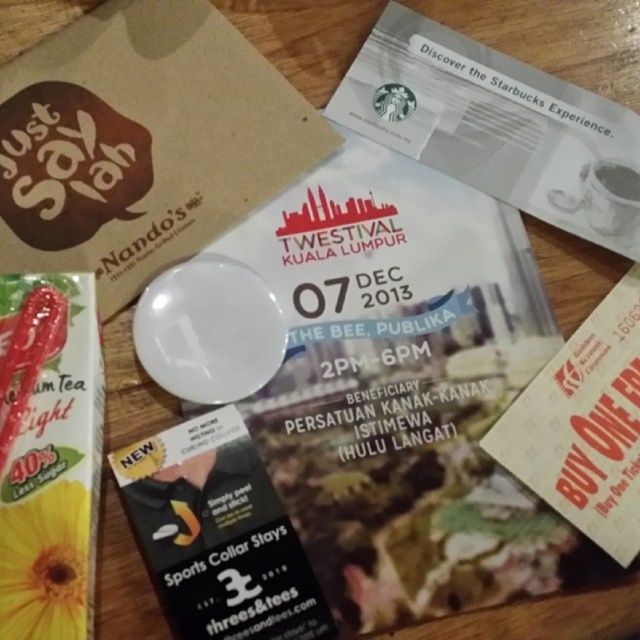
Question: Which point appears farthest from the camera in this image?

Choices:
 (A) (x=60, y=550)
 (B) (x=616, y=161)
 (C) (x=230, y=540)

Answer: (B)

Question: Is white paper at upper center above yellow paper at lower left?

Choices:
 (A) no
 (B) yes

Answer: (B)

Question: Among these objects, which one is nearest to the camera?

Choices:
 (A) yellow paper at lower left
 (B) white paper at upper center

Answer: (A)

Question: Can you confirm if yellow paper at lower left is positioned below black matte sports collar stays at center?

Choices:
 (A) no
 (B) yes

Answer: (A)

Question: Does white paper at upper center have a larger size compared to white ceramic mug at upper right?

Choices:
 (A) no
 (B) yes

Answer: (B)

Question: Which is nearer to the yellow paper at lower left?

Choices:
 (A) white paper at upper center
 (B) black matte sports collar stays at center
 (C) white ceramic mug at upper right

Answer: (B)